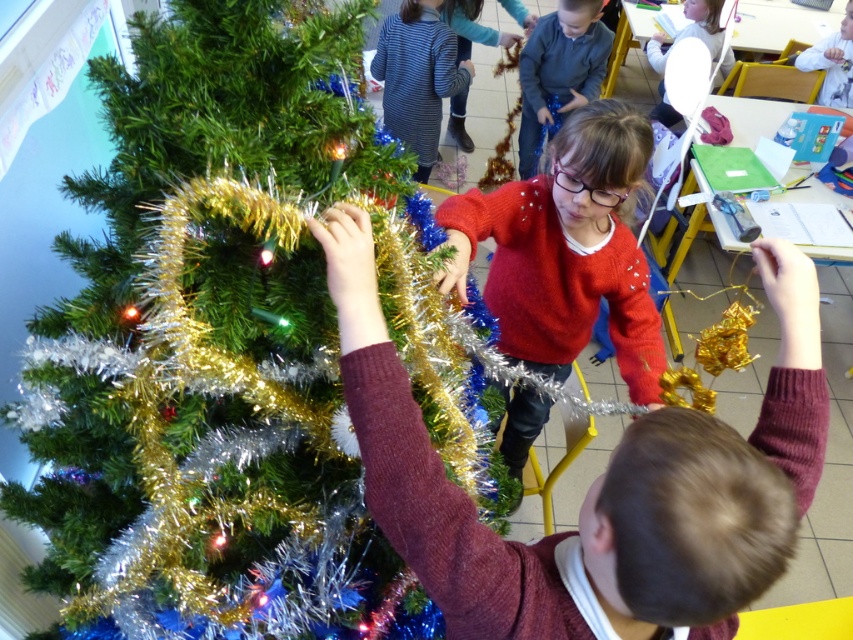
Consider the image. Does maroon sweater at center have a greater height compared to red sweater at center?

In fact, maroon sweater at center may be shorter than red sweater at center.

Between maroon sweater at center and red sweater at center, which one appears on the right side from the viewer's perspective?

From the viewer's perspective, red sweater at center appears more on the right side.

Measure the distance between maroon sweater at center and camera.

A distance of 24.86 inches exists between maroon sweater at center and camera.

The height and width of the screenshot is (640, 853). I want to click on maroon sweater at center, so click(595, 484).

Is maroon sweater at center smaller than striped fabric dress at upper center?

Indeed, maroon sweater at center has a smaller size compared to striped fabric dress at upper center.

The width and height of the screenshot is (853, 640). I want to click on maroon sweater at center, so click(x=595, y=484).

Between striped fabric dress at upper center and gray wool sweater at upper center, which one appears on the left side from the viewer's perspective?

Positioned to the left is striped fabric dress at upper center.

This screenshot has width=853, height=640. What do you see at coordinates (416, 76) in the screenshot?
I see `striped fabric dress at upper center` at bounding box center [416, 76].

What are the coordinates of `striped fabric dress at upper center` in the screenshot? It's located at (416, 76).